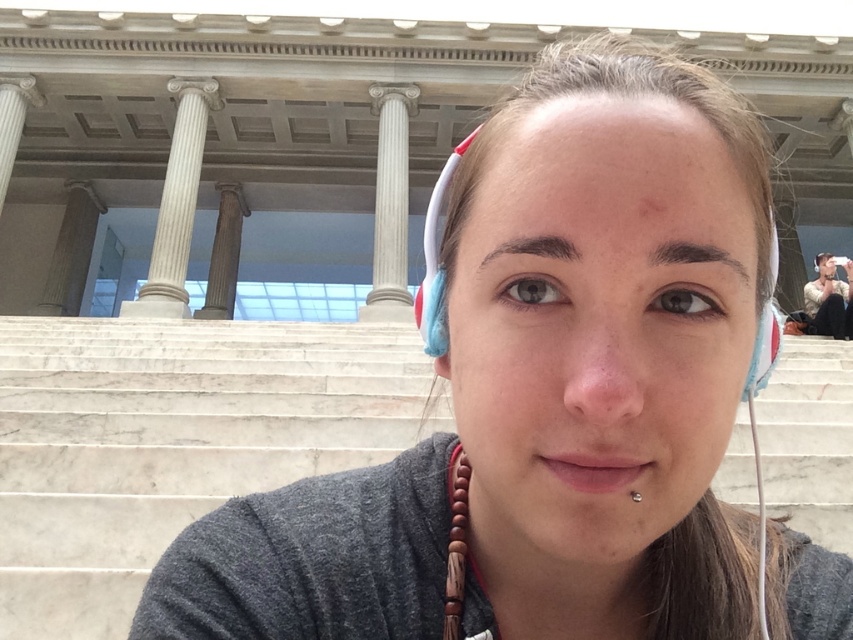
Question: Is white marble stairs at center bigger than white marble column at upper center?

Choices:
 (A) yes
 (B) no

Answer: (A)

Question: Which of these objects is positioned farthest from the brown polished stone column at center?

Choices:
 (A) silver metallic earring at lower center
 (B) light brown leather jacket at upper right
 (C) white marble column at upper center
 (D) white marble column at center

Answer: (A)

Question: Which of the following is the farthest from the observer?

Choices:
 (A) (70, 212)
 (B) (32, 83)
 (C) (408, 401)
 (D) (218, 228)

Answer: (A)

Question: Is white marble stairs at center behind brown polished stone column at center?

Choices:
 (A) no
 (B) yes

Answer: (A)

Question: Does white marble column at center come behind light brown leather jacket at upper right?

Choices:
 (A) no
 (B) yes

Answer: (B)

Question: Which point is farther from the camera taking this photo?

Choices:
 (A) (831, 291)
 (B) (22, 120)
 (C) (242, 195)
 (D) (398, 179)

Answer: (C)